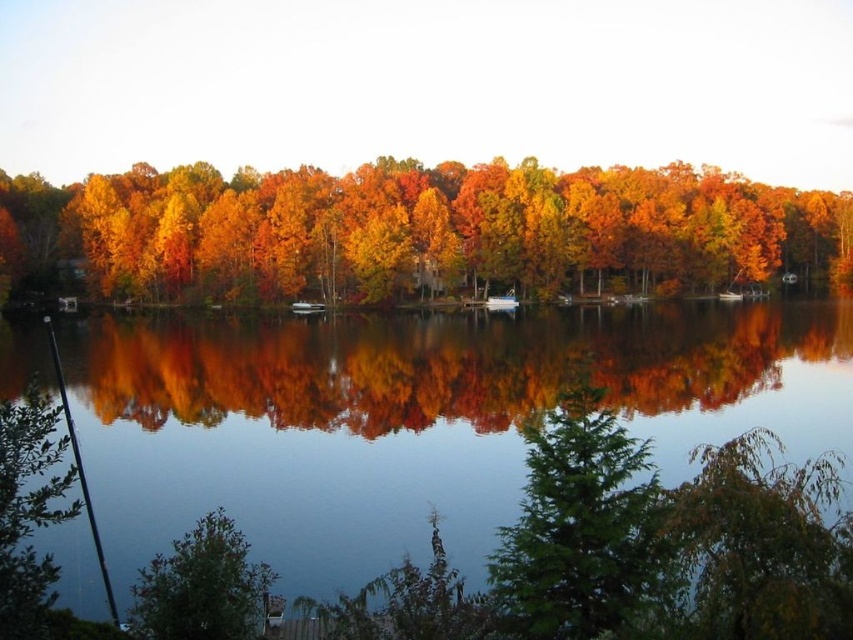
You are standing at the lakeside and notice the autumn leaves at center and the green matte tree at center. Which object is closer to you?

The autumn leaves at center are closer to you because the green matte tree at center is behind them.

You are standing at the lakeside and want to take a photo of both the green leafy tree at lower left and the white glossy boat at center. Which object should you frame first in your camera to ensure both are fully visible in the photo?

You should frame the green leafy tree at lower left first because it is taller than the white glossy boat at center, so you need to ensure its full height is captured before adjusting the frame to include the boat.

You are standing at the lakeside and want to determine which of the two points, point [321,284] or point [589,468], is closer to you. Based on the scene, which point is nearer?

Point [321,284] is closer to you because it is further to the viewer than point [589,468].